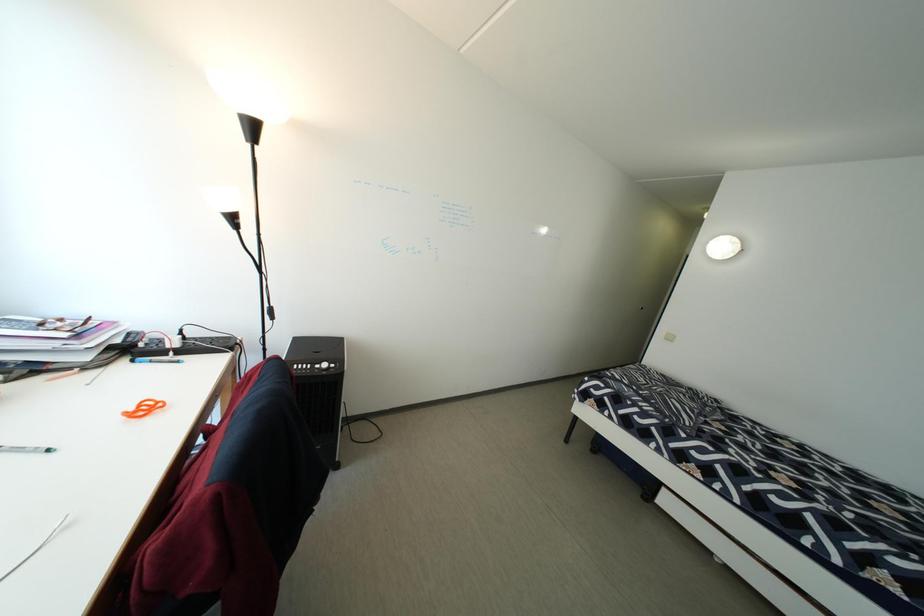
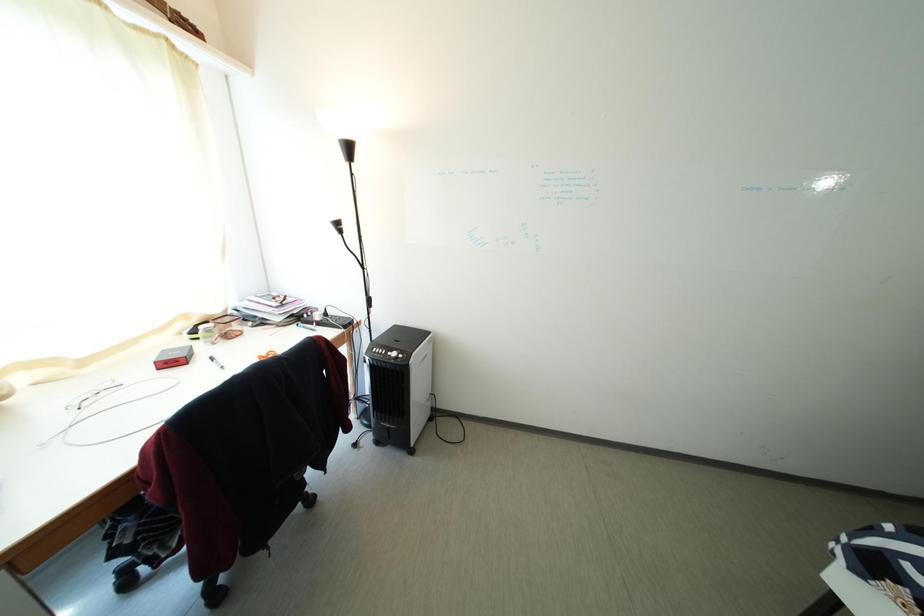
Question: The images are taken continuously from a first-person perspective. In which direction is your viewpoint rotating?

Choices:
 (A) Left
 (B) Right
 (C) Up
 (D) Down

Answer: (A)